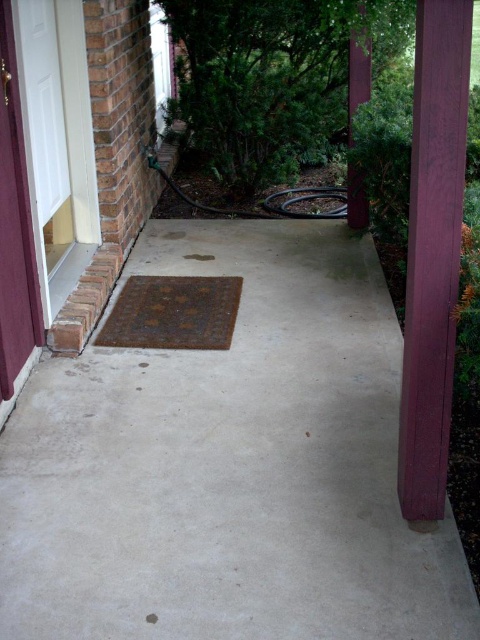
Question: Is rusty metal doormat at center closer to camera compared to purple wood post at upper right?

Choices:
 (A) no
 (B) yes

Answer: (B)

Question: Which is nearer to the gray concrete at center?

Choices:
 (A) rusty metal doormat at center
 (B) purple wood post at right
 (C) rusty metal manhole cover at center

Answer: (A)

Question: Which point is closer to the camera taking this photo?

Choices:
 (A) coord(412,380)
 (B) coord(164,320)

Answer: (A)

Question: Which object appears farthest from the camera in this image?

Choices:
 (A) purple wood post at upper right
 (B) gray concrete at center

Answer: (A)

Question: Can you confirm if purple wood post at right is thinner than purple wood post at upper right?

Choices:
 (A) no
 (B) yes

Answer: (A)

Question: Is rusty metal doormat at center below purple wood post at upper right?

Choices:
 (A) yes
 (B) no

Answer: (A)